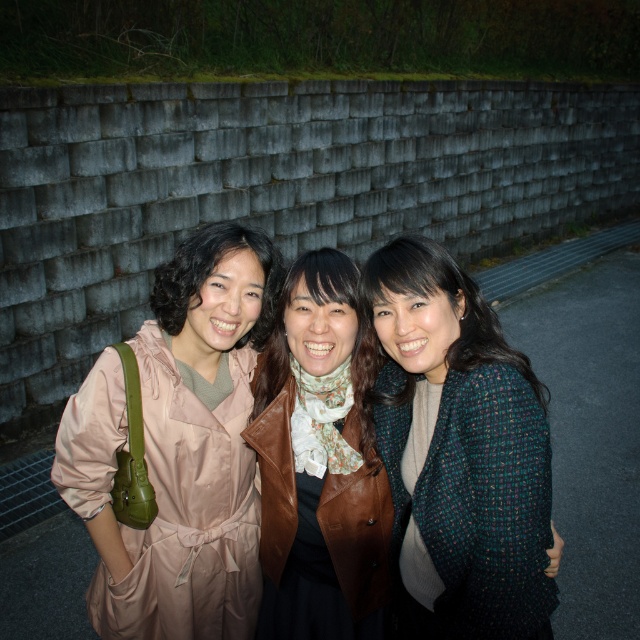
Is green tweed jacket at center further to the viewer compared to brown leather jacket at center?

No, it is not.

Does green tweed jacket at center appear on the right side of brown leather jacket at center?

Correct, you'll find green tweed jacket at center to the right of brown leather jacket at center.

Where is `green tweed jacket at center`? The width and height of the screenshot is (640, 640). green tweed jacket at center is located at coordinates coord(458,452).

I want to click on green tweed jacket at center, so click(x=458, y=452).

Does matte pink coat at left have a greater height compared to brown leather jacket at center?

Yes.

Does matte pink coat at left have a greater width compared to brown leather jacket at center?

Indeed, matte pink coat at left has a greater width compared to brown leather jacket at center.

The image size is (640, 640). What do you see at coordinates (179, 448) in the screenshot?
I see `matte pink coat at left` at bounding box center [179, 448].

The width and height of the screenshot is (640, 640). Find the location of `matte pink coat at left`. matte pink coat at left is located at coordinates (179, 448).

Consider the image. Can you confirm if matte pink coat at left is smaller than green tweed jacket at center?

No.

Is point (224, 618) behind point (444, 544)?

Yes, it is.

Locate an element on the screen. Image resolution: width=640 pixels, height=640 pixels. matte pink coat at left is located at coordinates (179, 448).

Find the location of `matte pink coat at left`. matte pink coat at left is located at coordinates (179, 448).